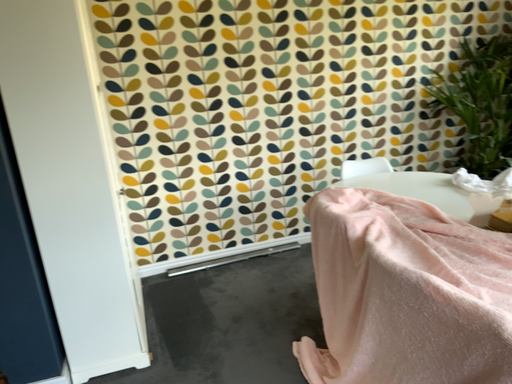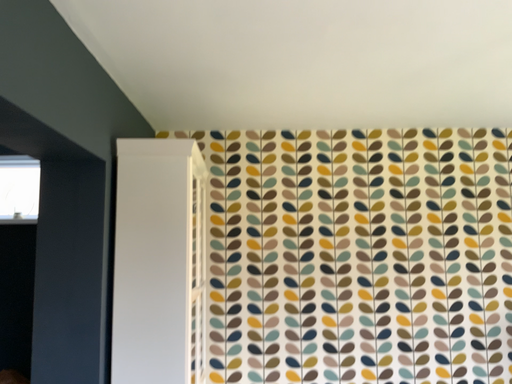
Question: How did the camera likely rotate when shooting the video?

Choices:
 (A) rotated left
 (B) rotated right

Answer: (A)